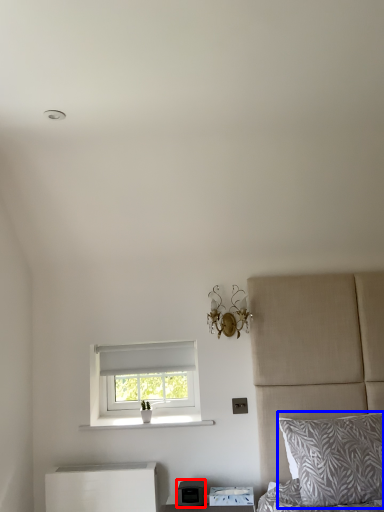
Question: Which object is closer to the camera taking this photo, appliance (highlighted by a red box) or pillow (highlighted by a blue box)?

Choices:
 (A) appliance
 (B) pillow

Answer: (B)